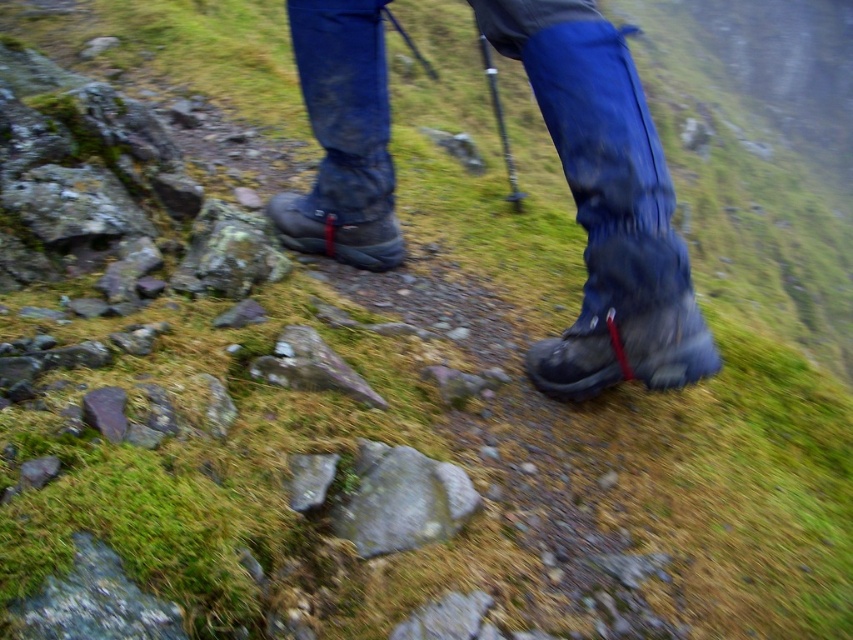
Question: Does matte black boot at lower right have a greater width compared to matte black boot at center?

Choices:
 (A) yes
 (B) no

Answer: (B)

Question: Based on their relative distances, which object is nearer to the matte black hiking boot at center?

Choices:
 (A) matte black boot at lower right
 (B) matte black boot at center

Answer: (A)

Question: Can you confirm if matte black hiking boot at center is bigger than matte black boot at lower right?

Choices:
 (A) yes
 (B) no

Answer: (A)

Question: Which is nearer to the matte black boot at center?

Choices:
 (A) matte black boot at lower right
 (B) matte black hiking boot at center

Answer: (B)

Question: From the image, what is the correct spatial relationship of matte black hiking boot at center in relation to matte black boot at lower right?

Choices:
 (A) left
 (B) right

Answer: (B)

Question: Which is farther from the matte black boot at lower right?

Choices:
 (A) matte black boot at center
 (B) matte black hiking boot at center

Answer: (A)